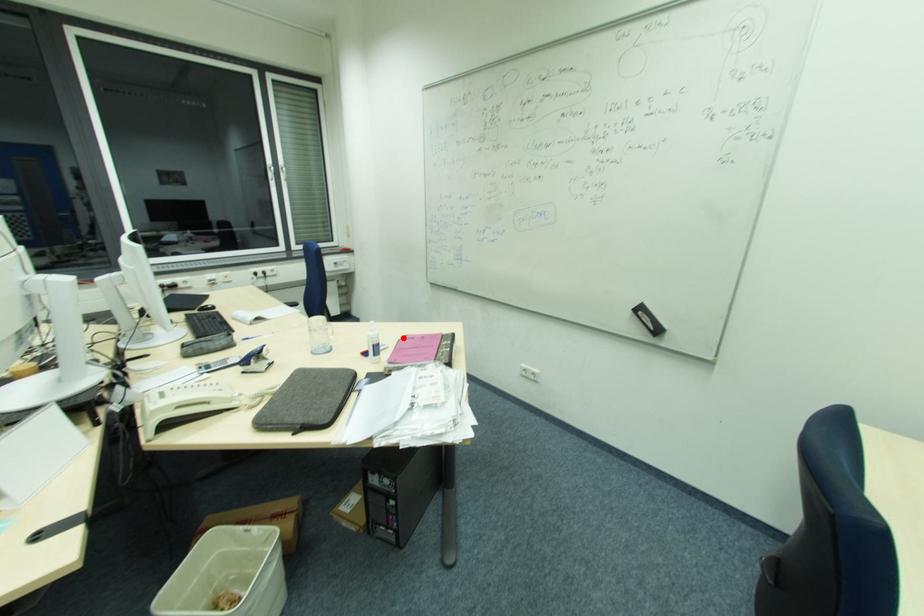
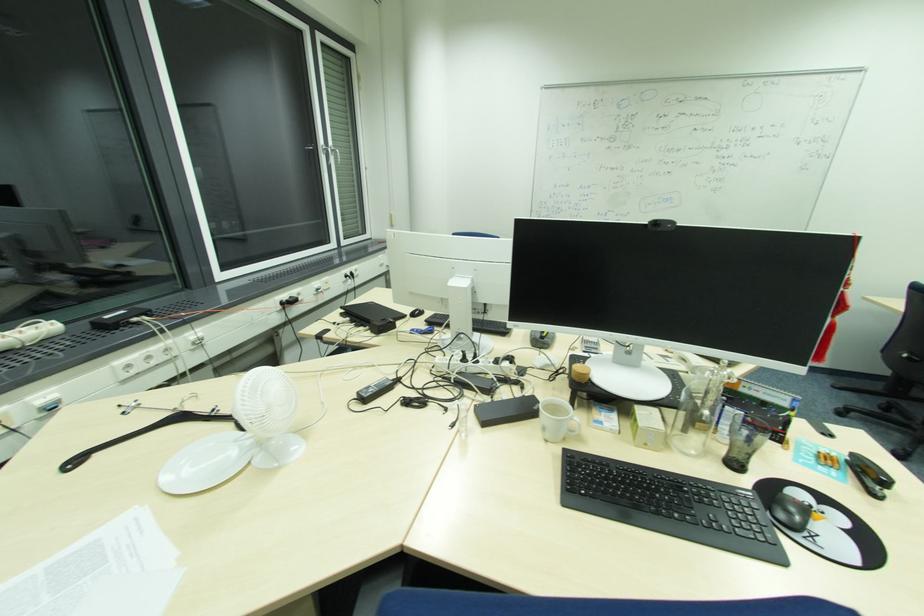
Locate, in the second image, the point that corresponds to the highlighted location in the first image.

(650, 300)